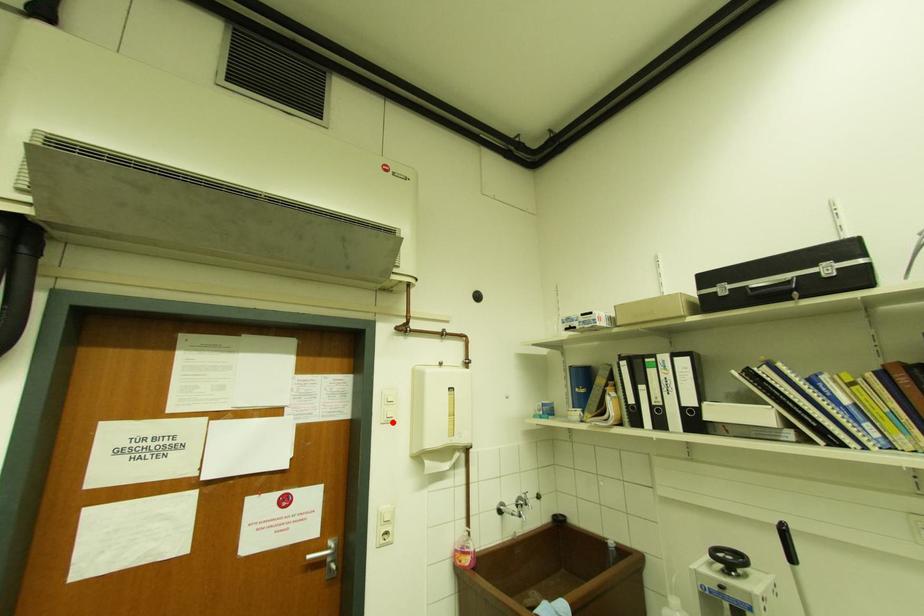
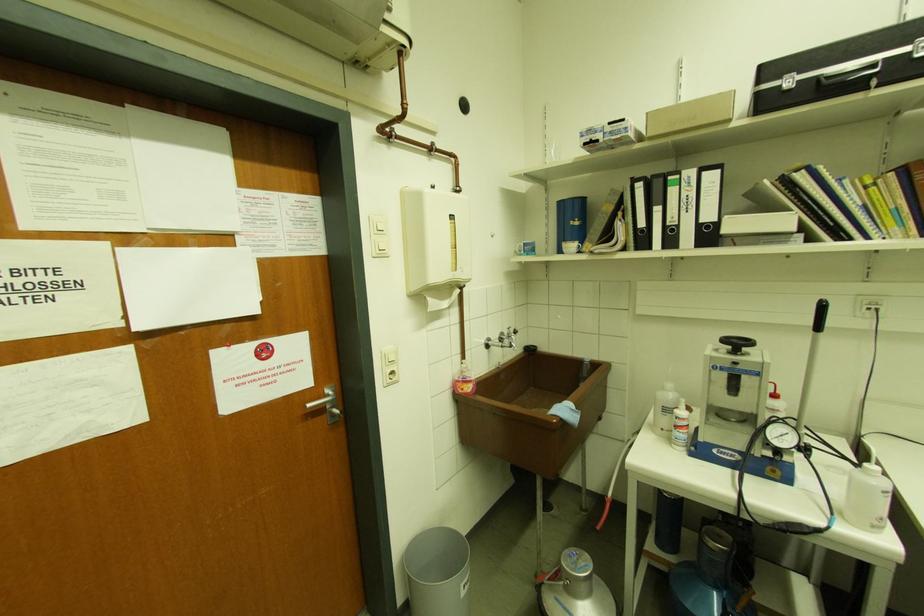
Where in the second image is the point corresponding to the highlighted location from the first image?

(385, 256)